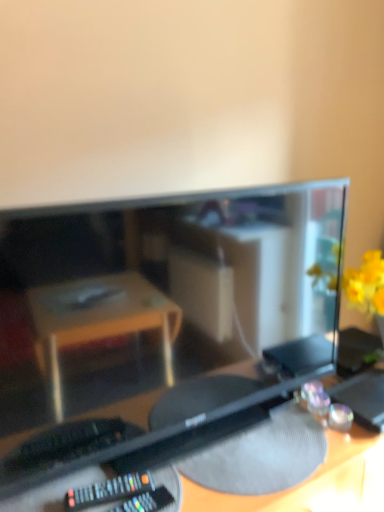
Question: Is matte black monitor at center to the left of black plastic desk at center from the viewer's perspective?

Choices:
 (A) yes
 (B) no

Answer: (A)

Question: From the image's perspective, is matte black monitor at center over black plastic desk at center?

Choices:
 (A) no
 (B) yes

Answer: (B)

Question: Can you confirm if matte black monitor at center is positioned to the right of black plastic desk at center?

Choices:
 (A) no
 (B) yes

Answer: (A)

Question: Is matte black monitor at center taller than black plastic desk at center?

Choices:
 (A) no
 (B) yes

Answer: (A)

Question: Considering the relative sizes of matte black monitor at center and black plastic desk at center in the image provided, is matte black monitor at center bigger than black plastic desk at center?

Choices:
 (A) no
 (B) yes

Answer: (A)

Question: Considering the relative positions of black plastic desk at center and matte black monitor at center in the image provided, is black plastic desk at center to the left or to the right of matte black monitor at center?

Choices:
 (A) right
 (B) left

Answer: (A)

Question: Considering the positions of point (347, 347) and point (284, 309), is point (347, 347) closer or farther from the camera than point (284, 309)?

Choices:
 (A) closer
 (B) farther

Answer: (B)

Question: Choose the correct answer: Is black plastic desk at center inside matte black monitor at center or outside it?

Choices:
 (A) inside
 (B) outside

Answer: (B)

Question: Based on their sizes in the image, would you say black plastic desk at center is bigger or smaller than matte black monitor at center?

Choices:
 (A) big
 (B) small

Answer: (A)

Question: Considering the positions of matte black monitor at center and black plastic remote at lower left in the image, is matte black monitor at center wider or thinner than black plastic remote at lower left?

Choices:
 (A) wide
 (B) thin

Answer: (A)

Question: From the image's perspective, is matte black monitor at center positioned above or below black plastic remote at lower left?

Choices:
 (A) below
 (B) above

Answer: (B)

Question: Looking at the image, does matte black monitor at center seem bigger or smaller compared to black plastic remote at lower left?

Choices:
 (A) small
 (B) big

Answer: (B)

Question: From their relative heights in the image, would you say matte black monitor at center is taller or shorter than black plastic remote at lower left?

Choices:
 (A) short
 (B) tall

Answer: (B)

Question: Considering the positions of point (66, 505) and point (379, 366), is point (66, 505) closer or farther from the camera than point (379, 366)?

Choices:
 (A) farther
 (B) closer

Answer: (B)

Question: Looking at their shapes, would you say black plastic remote at lower left is wider or thinner than black plastic desk at center?

Choices:
 (A) wide
 (B) thin

Answer: (B)